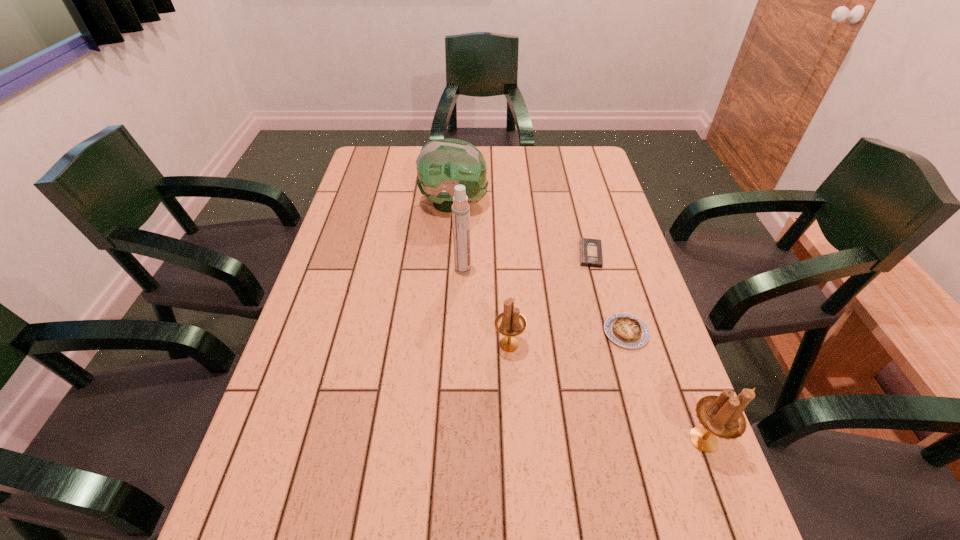
You are a GUI agent. You are given a task and a screenshot of the screen. Output one action in this format:
    pyautogui.click(x=<x>, y=<y>)
    Task: Click on the fourth tallest object
    
    Given the screenshot: What is the action you would take?
    pyautogui.click(x=510, y=322)

Where is `the farther candle holder`? The height and width of the screenshot is (540, 960). the farther candle holder is located at coordinates (510, 322).

Find the location of a particular element. the taller candle holder is located at coordinates (722, 416).

Identify the location of the nearer candle holder. (722, 416).

Where is `the tallest object`? Image resolution: width=960 pixels, height=540 pixels. the tallest object is located at coordinates [x=460, y=208].

Locate an element on the screen. This screenshot has width=960, height=540. the farthest object is located at coordinates click(442, 164).

Locate an element on the screen. The width and height of the screenshot is (960, 540). the fifth tallest object is located at coordinates click(x=626, y=330).

Identify the location of the shortest object. (591, 255).

Identify the location of vacant space positioned 0.090m on the left of the fourth tallest object. point(456,344).

The height and width of the screenshot is (540, 960). What are the coordinates of `free spot located 0.160m on the left of the taller candle holder` in the screenshot? It's located at (602, 440).